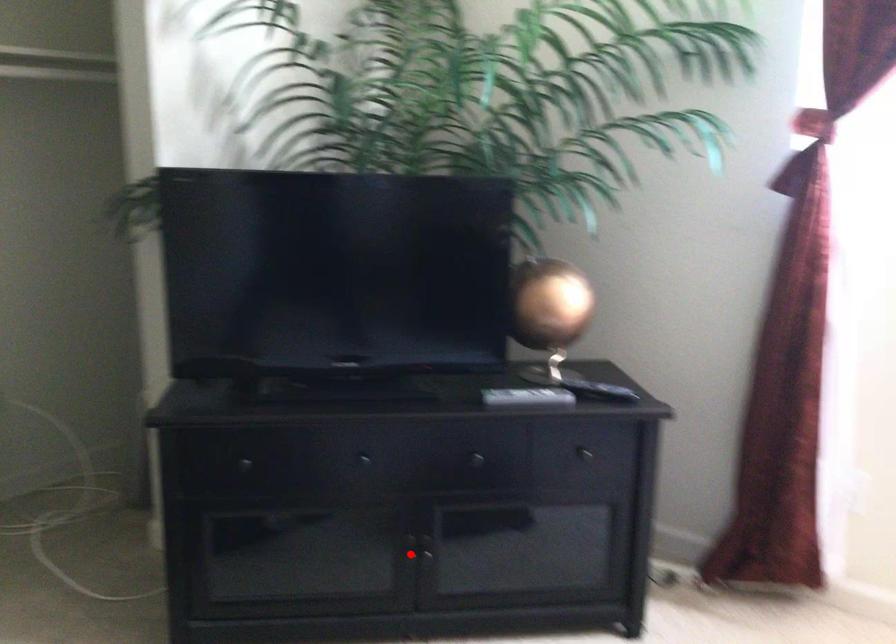
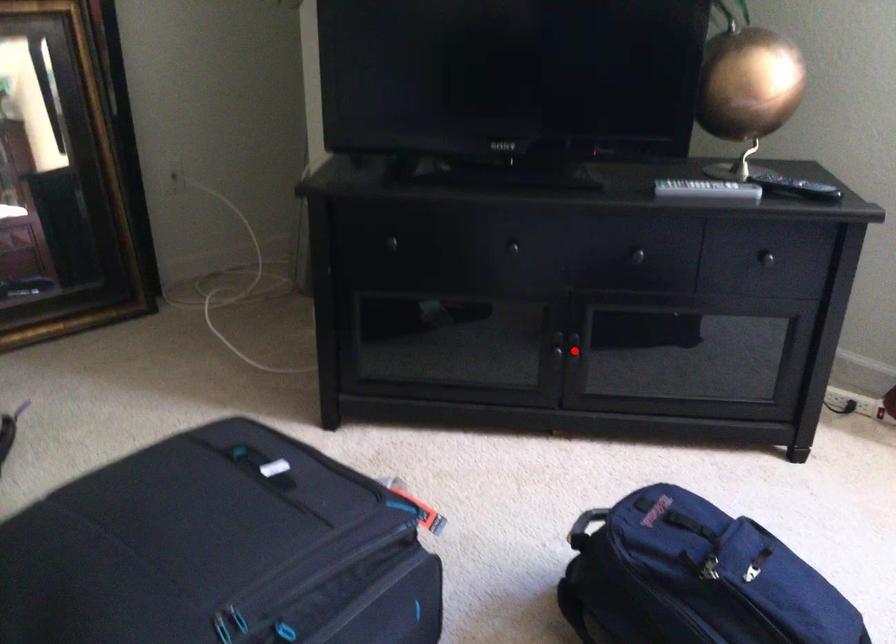
I am providing you with two images of the same scene from different viewpoints. A red point is marked on the first image and another point is marked on the second image. Are the points marked in image1 and image2 representing the same 3D position?

No